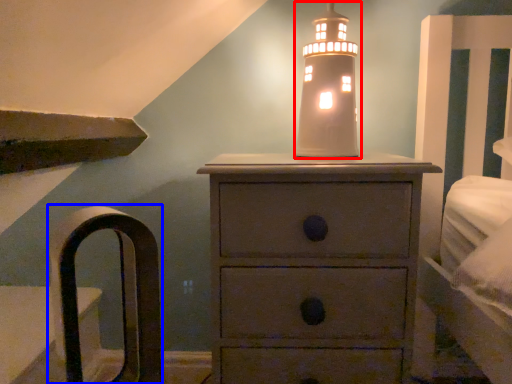
Question: Among these objects, which one is nearest to the camera, candle holder (highlighted by a red box) or armchair (highlighted by a blue box)?

Choices:
 (A) candle holder
 (B) armchair

Answer: (B)